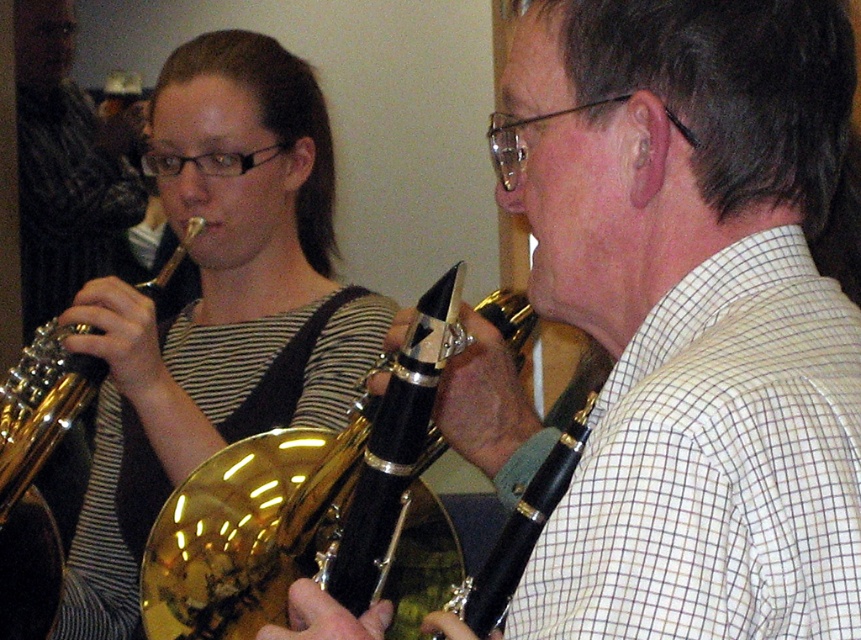
Can you confirm if gold shiny trumpet at center is thinner than gold shiny trumpet at left?

In fact, gold shiny trumpet at center might be wider than gold shiny trumpet at left.

Does gold shiny trumpet at center come behind gold shiny trumpet at left?

No, gold shiny trumpet at center is closer to the viewer.

You are a GUI agent. You are given a task and a screenshot of the screen. Output one action in this format:
    pyautogui.click(x=<x>, y=<y>)
    Task: Click on the gold shiny trumpet at center
    
    Given the screenshot: What is the action you would take?
    pyautogui.click(x=311, y=508)

Can you confirm if gold shiny trumpet at center is smaller than brushed metal saxophone at upper left?

Indeed, gold shiny trumpet at center has a smaller size compared to brushed metal saxophone at upper left.

Does gold shiny trumpet at center have a lesser height compared to brushed metal saxophone at upper left?

Correct, gold shiny trumpet at center is not as tall as brushed metal saxophone at upper left.

Measure the distance between gold shiny trumpet at center and camera.

The distance of gold shiny trumpet at center from camera is 31.07 inches.

Find the location of `gold shiny trumpet at center`. gold shiny trumpet at center is located at coordinates (311, 508).

Is point (282, 352) more distant than point (72, 96)?

No.

Measure the distance between point (245, 246) and camera.

5.29 feet

Which is behind, point (168, 451) or point (36, 296)?

The point (36, 296) is more distant.

The image size is (861, 640). What are the coordinates of `matte black clarinet at upper left` in the screenshot? It's located at (215, 308).